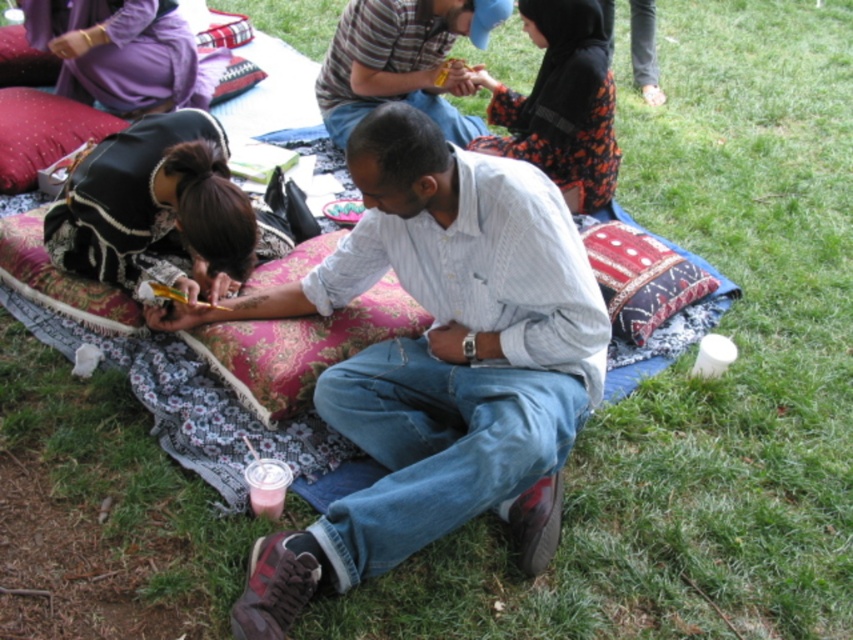
Question: Where is black floral dress at center located in relation to matte purple dress at upper left in the image?

Choices:
 (A) left
 (B) right

Answer: (B)

Question: Which of the following is the farthest from the observer?

Choices:
 (A) red velvet cushion at upper left
 (B) velvet cushion at upper left

Answer: (B)

Question: Can you confirm if white striped shirt at center is positioned above red velvet cushion at upper left?

Choices:
 (A) yes
 (B) no

Answer: (B)

Question: Where is red velvet cushion at upper left located in relation to velvet cushion at upper left in the image?

Choices:
 (A) above
 (B) below

Answer: (B)

Question: Which object appears farthest from the camera in this image?

Choices:
 (A) velvet cushion at upper left
 (B) black lace dress at center
 (C) black floral dress at center
 (D) striped cotton shirt at upper center

Answer: (A)

Question: Which point is farther from the camera taking this photo?

Choices:
 (A) (273, 406)
 (B) (167, 237)
 (C) (325, 579)

Answer: (B)